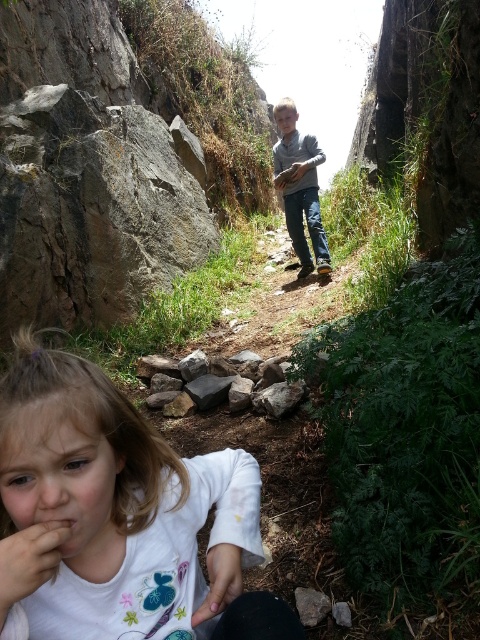
Question: Is smooth skin hand at lower left thinner than smooth skin hand at center?

Choices:
 (A) no
 (B) yes

Answer: (B)

Question: Does smooth skin hand at lower left appear under smooth skin hand at center?

Choices:
 (A) no
 (B) yes

Answer: (B)

Question: Which point is farther to the camera?

Choices:
 (A) smooth skin hand at lower left
 (B) white soft shirt at lower left
 (C) gray sweater at center

Answer: (C)

Question: Does gray rock at center come behind smooth skin hand at lower left?

Choices:
 (A) yes
 (B) no

Answer: (A)

Question: Which object appears farthest from the camera in this image?

Choices:
 (A) gray sweater at center
 (B) smooth skin hand at lower left

Answer: (A)

Question: Considering the real-world distances, which object is farthest from the brown rough rock at lower center?

Choices:
 (A) smooth skin hand at lower left
 (B) smooth skin hand at center
 (C) white soft shirt at lower left

Answer: (B)